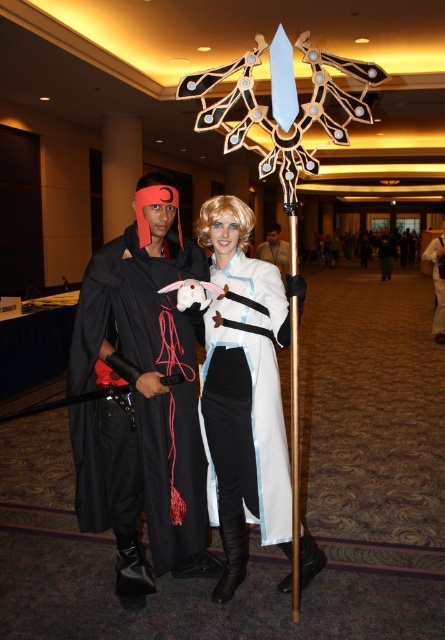
You are a photographer standing at the camera position. You want to take a closeup shot of the matte black cape at left without moving the camera. Can you zoom in enough to capture the entire cape in the frame?

The matte black cape at left is 6.76 feet away from camera. Since the cape is at this distance, you can zoom in sufficiently to capture the entire cape in the frame without moving the camera.

In the scene shown: You are standing in the convention hall and see the white matte scarf at center. Could you describe its exact location using coordinates?

The white matte scarf at center is located at coordinates point (437, 282).